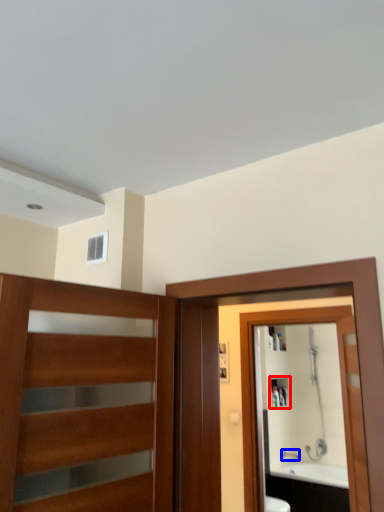
Question: Among these objects, which one is farthest to the camera, cabinet (highlighted by a red box) or faucet (highlighted by a blue box)?

Choices:
 (A) cabinet
 (B) faucet

Answer: (A)